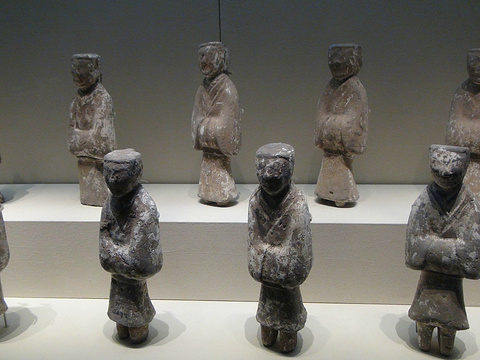
Locate an element on the screen. Image resolution: width=480 pixels, height=360 pixels. wall is located at coordinates coord(287,38).